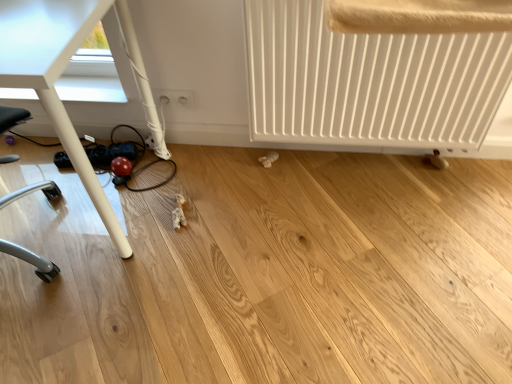
In order to click on free region under white matte radiator at lower right (from a real-world perspective) in this screenshot , I will do `click(369, 162)`.